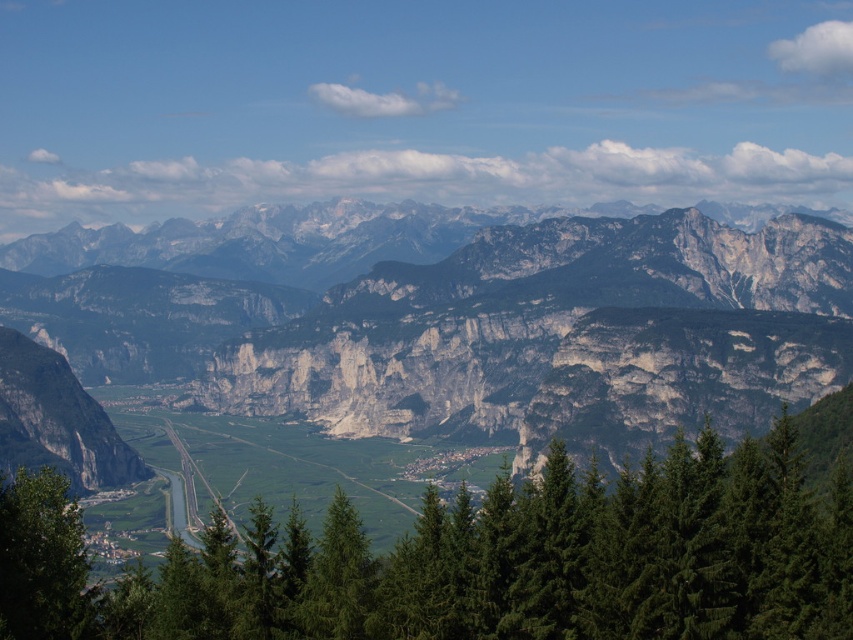
Is rocky gray mountain range at center taller than green leafy tree at lower left?

Yes.

Who is lower down, rocky gray mountain range at center or green leafy tree at lower left?

green leafy tree at lower left is lower down.

Where is `rocky gray mountain range at center`? The image size is (853, 640). rocky gray mountain range at center is located at coordinates (485, 332).

Between green textured tree at center and green leafy tree at lower left, which one has more height?

Standing taller between the two is green textured tree at center.

Is green textured tree at center smaller than green leafy tree at lower left?

Incorrect, green textured tree at center is not smaller in size than green leafy tree at lower left.

Measure the distance between green textured tree at center and camera.

A distance of 235.10 feet exists between green textured tree at center and camera.

Where is `green textured tree at center`? The image size is (853, 640). green textured tree at center is located at coordinates (476, 561).

Measure the distance between point (140, 369) and camera.

Point (140, 369) is 563.22 meters away from camera.

You are a GUI agent. You are given a task and a screenshot of the screen. Output one action in this format:
    pyautogui.click(x=<x>, y=<y>)
    Task: Click on the rocky gray mountain range at center
    The height and width of the screenshot is (640, 853).
    Given the screenshot: What is the action you would take?
    pyautogui.click(x=485, y=332)